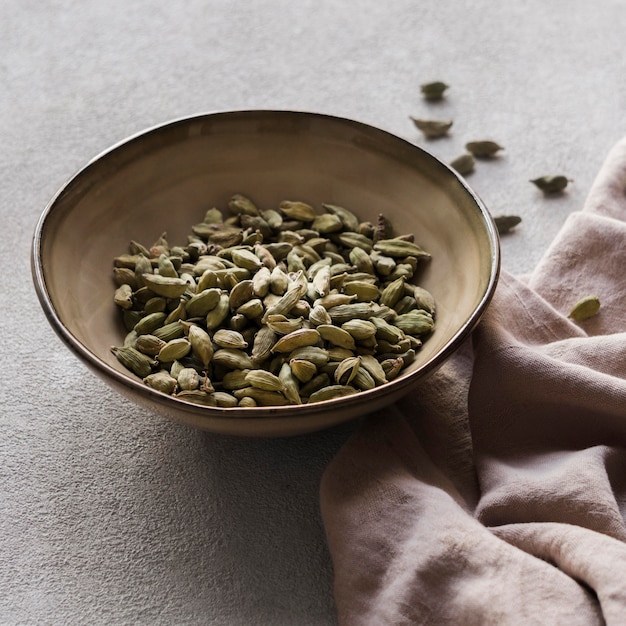
Find the location of a particular element. dark brown border on inside of bowl is located at coordinates (248, 123), (141, 150), (437, 173).